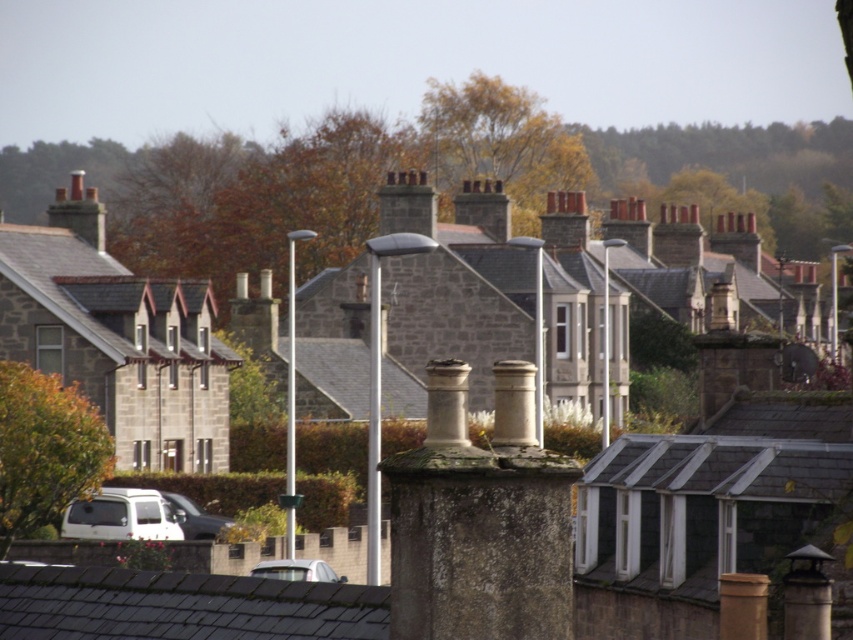
Which is more to the right, white matte van at lower left or white matte car at lower center?

Positioned to the right is white matte car at lower center.

Consider the image. Who is taller, white matte van at lower left or white matte car at lower center?

white matte car at lower center is taller.

Does point (158, 506) come farther from viewer compared to point (331, 572)?

Yes, it is behind point (331, 572).

Locate an element on the screen. white matte van at lower left is located at coordinates (120, 516).

You are a GUI agent. You are given a task and a screenshot of the screen. Output one action in this format:
    pyautogui.click(x=<x>, y=<y>)
    Task: Click on the green leafy tree at lower left
    The image size is (853, 640).
    Given the screenshot: What is the action you would take?
    pyautogui.click(x=45, y=449)

How distant is green leafy tree at lower left from white matte van at lower left?

green leafy tree at lower left is 9.20 meters from white matte van at lower left.

The image size is (853, 640). Describe the element at coordinates (45, 449) in the screenshot. I see `green leafy tree at lower left` at that location.

Find the location of a particular element. This screenshot has width=853, height=640. green leafy tree at lower left is located at coordinates (45, 449).

Which is behind, point (108, 490) or point (177, 513)?

Positioned behind is point (177, 513).

Can you confirm if white matte van at lower left is bigger than silver metallic car at lower left?

Yes.

Identify the location of white matte van at lower left. (120, 516).